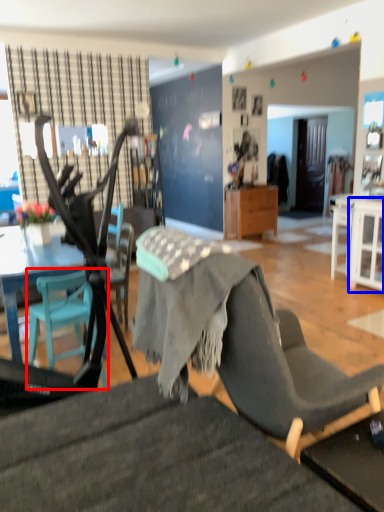
Question: Which point is closer to the camera, chair (highlighted by a red box) or cabinetry (highlighted by a blue box)?

Choices:
 (A) chair
 (B) cabinetry

Answer: (A)